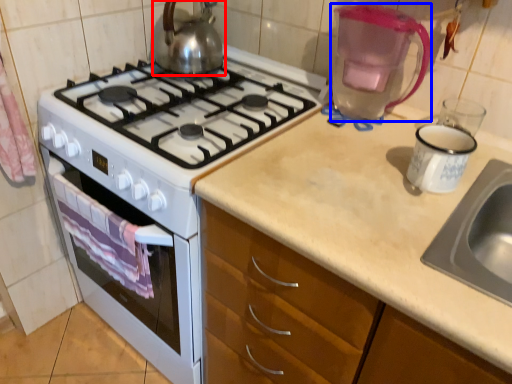
Question: Which of the following is the closest to the observer, kettle (highlighted by a red box) or coffeepot (highlighted by a blue box)?

Choices:
 (A) kettle
 (B) coffeepot

Answer: (B)